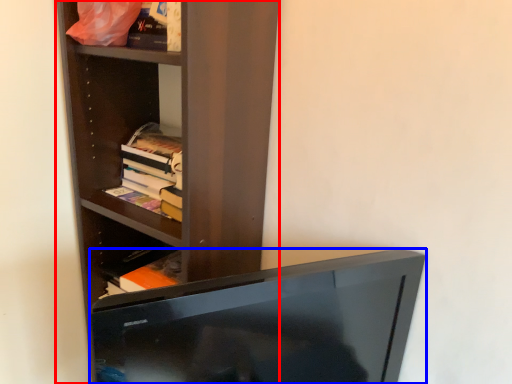
Question: Which of the following is the farthest to the observer, shelf (highlighted by a red box) or television (highlighted by a blue box)?

Choices:
 (A) shelf
 (B) television

Answer: (A)